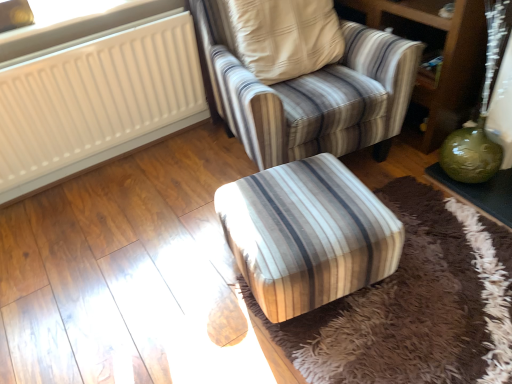
Question: Is white plastic radiator at upper left oriented towards green glossy vase at lower right?

Choices:
 (A) no
 (B) yes

Answer: (A)

Question: Are white plastic radiator at upper left and green glossy vase at lower right making contact?

Choices:
 (A) no
 (B) yes

Answer: (A)

Question: Is green glossy vase at lower right at the back of white plastic radiator at upper left?

Choices:
 (A) no
 (B) yes

Answer: (A)

Question: Does white plastic radiator at upper left have a greater height compared to green glossy vase at lower right?

Choices:
 (A) yes
 (B) no

Answer: (B)

Question: Would you say white plastic radiator at upper left contains green glossy vase at lower right?

Choices:
 (A) yes
 (B) no

Answer: (B)

Question: Considering the positions of white plastic radiator at upper left and green glossy vase at right in the image, is white plastic radiator at upper left taller or shorter than green glossy vase at right?

Choices:
 (A) short
 (B) tall

Answer: (B)

Question: In terms of width, does white plastic radiator at upper left look wider or thinner when compared to green glossy vase at right?

Choices:
 (A) thin
 (B) wide

Answer: (A)

Question: Considering the positions of point (173, 8) and point (508, 175), is point (173, 8) closer or farther from the camera than point (508, 175)?

Choices:
 (A) farther
 (B) closer

Answer: (A)

Question: In terms of size, does white plastic radiator at upper left appear bigger or smaller than green glossy vase at right?

Choices:
 (A) small
 (B) big

Answer: (B)

Question: From a real-world perspective, is green glossy vase at lower right above or below green glass vase at right?

Choices:
 (A) above
 (B) below

Answer: (B)

Question: In terms of size, does green glossy vase at lower right appear bigger or smaller than green glass vase at right?

Choices:
 (A) small
 (B) big

Answer: (B)

Question: Is green glossy vase at lower right taller or shorter than green glass vase at right?

Choices:
 (A) tall
 (B) short

Answer: (A)

Question: Relative to green glass vase at right, is green glossy vase at lower right in front or behind?

Choices:
 (A) front
 (B) behind

Answer: (B)

Question: From their relative heights in the image, would you say white plastic radiator at upper left is taller or shorter than striped fabric armchair at center?

Choices:
 (A) short
 (B) tall

Answer: (A)

Question: Is white plastic radiator at upper left bigger or smaller than striped fabric armchair at center?

Choices:
 (A) small
 (B) big

Answer: (A)